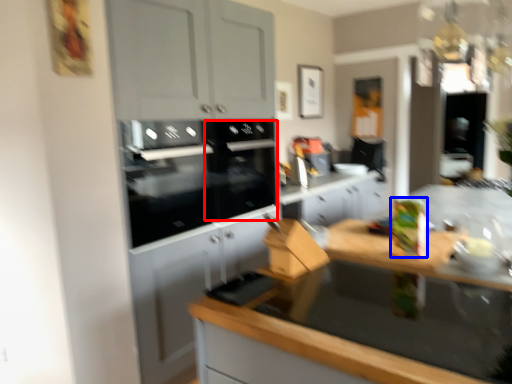
Question: Which point is further to the camera, appliance (highlighted by a red box) or appliance (highlighted by a blue box)?

Choices:
 (A) appliance
 (B) appliance

Answer: (A)